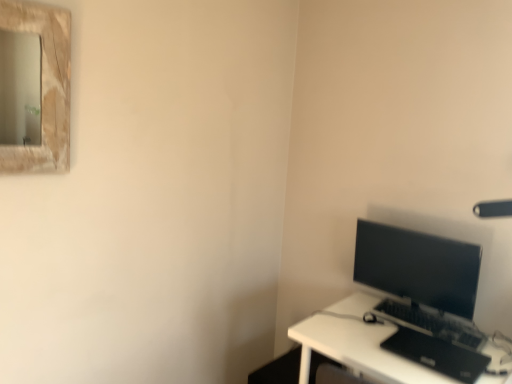
The width and height of the screenshot is (512, 384). I want to click on free region on the left part of black plastic keyboard at lower right, so click(x=355, y=327).